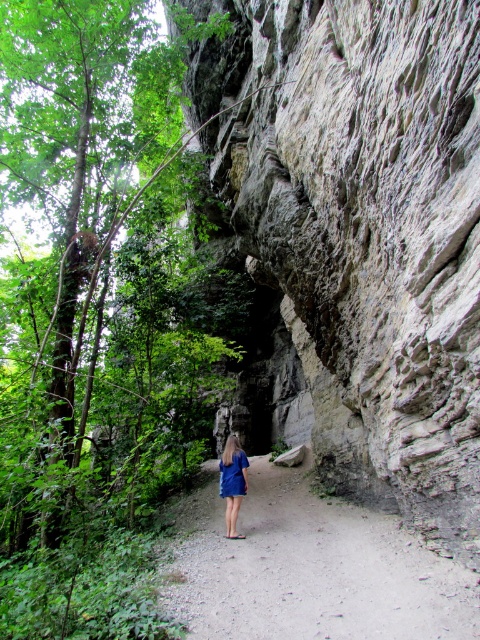
Is gray rough rock face at center shorter than blue satin dress at center?

No.

Who is more forward, (312, 134) or (239, 460)?

Point (312, 134)

At what (x,y) coordinates should I click in order to perform the action: click on gray rough rock face at center. Please return your answer as a coordinate pair (x, y). The height and width of the screenshot is (640, 480). Looking at the image, I should click on (362, 228).

Is dirt path at center above blue satin dress at center?

Actually, dirt path at center is below blue satin dress at center.

Does dirt path at center appear under blue satin dress at center?

Indeed, dirt path at center is positioned under blue satin dress at center.

Is point (346, 502) less distant than point (240, 468)?

No, it is behind (240, 468).

This screenshot has height=640, width=480. I want to click on dirt path at center, so (307, 568).

Which is below, blue fabric dress at center or blue satin dress at center?

blue fabric dress at center is below.

Is point (229, 483) behind point (232, 490)?

Yes.

The image size is (480, 640). I want to click on blue fabric dress at center, so click(232, 483).